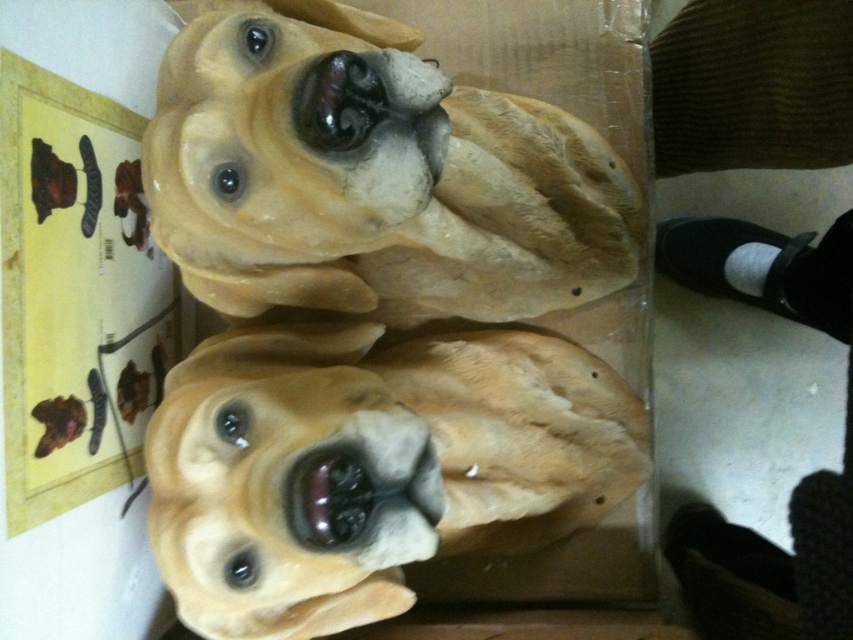
You are a photographer trying to capture a closeup shot of the matte clay dog heads at center. The camera you are using has a minimum focusing distance of 18 inches. Based on the scene described, will you be able to take a clear photo without moving the camera closer?

The distance between the matte clay dog heads at center and the camera is 21.29 inches. Since the minimum focusing distance is 18 inches, the camera can focus clearly at that distance. Therefore, you can take a clear photo without moving the camera closer.

You are an art student who needs to pack these two dog sculptures into a box that can only fit items up to 15 inches in height. You have the matte clay dog heads at center and the matte brown dog at center in front of you. Which sculpture should you choose to ensure it fits in the box?

The matte brown dog at center is smaller in size, so it should fit within the 15 inches height limit of the box.